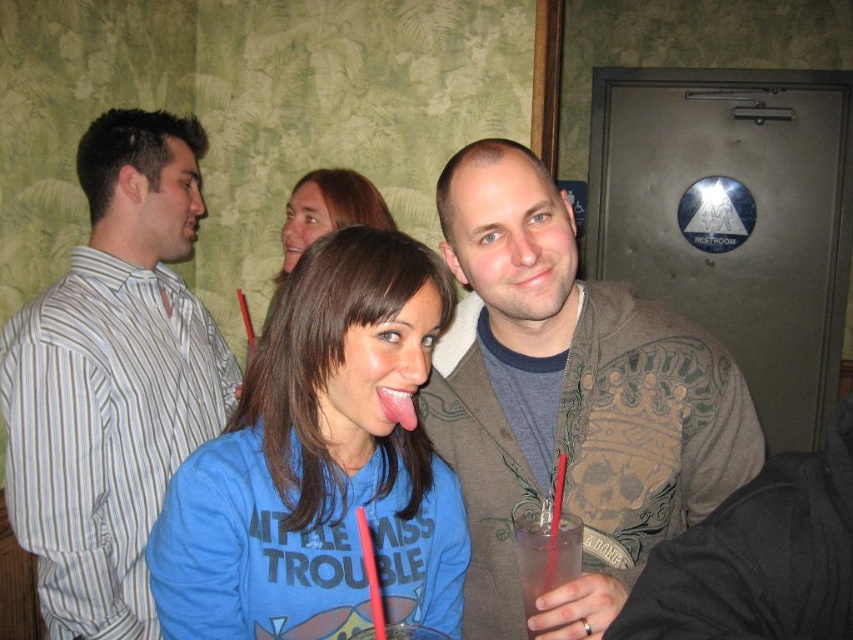
Does blue cotton shirt at center have a lesser height compared to pink glossy tongue at center?

In fact, blue cotton shirt at center may be taller than pink glossy tongue at center.

Is blue cotton shirt at center positioned in front of pink glossy tongue at center?

No.

Where is `blue cotton shirt at center`? blue cotton shirt at center is located at coordinates (328, 211).

Does blue cotton shirt at center have a lesser width compared to clear plastic cup at center?

Incorrect, blue cotton shirt at center's width is not less than clear plastic cup at center's.

Can you confirm if blue cotton shirt at center is positioned to the right of clear plastic cup at center?

In fact, blue cotton shirt at center is to the left of clear plastic cup at center.

You are a GUI agent. You are given a task and a screenshot of the screen. Output one action in this format:
    pyautogui.click(x=<x>, y=<y>)
    Task: Click on the blue cotton shirt at center
    
    Given the screenshot: What is the action you would take?
    pyautogui.click(x=328, y=211)

Is point (418, 381) more distant than point (383, 403)?

No, it is not.

Can you confirm if blue fleece sweatshirt at center is shorter than pink glossy tongue at center?

In fact, blue fleece sweatshirt at center may be taller than pink glossy tongue at center.

Which is in front, point (450, 573) or point (390, 392)?

Point (390, 392) is more forward.

Find the location of a particular element. blue fleece sweatshirt at center is located at coordinates (320, 465).